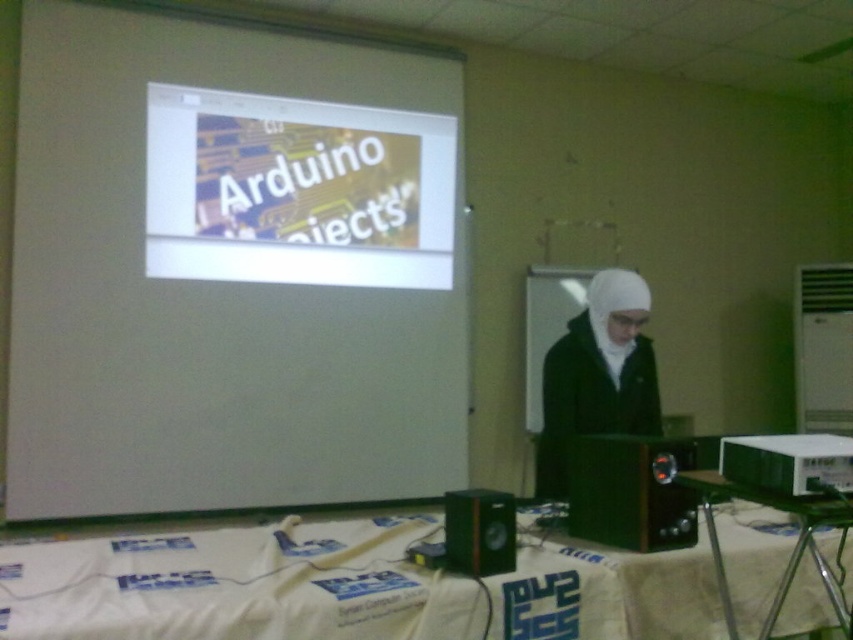
Who is positioned more to the right, green plastic table at lower right or white plastic projector at lower right?

From the viewer's perspective, white plastic projector at lower right appears more on the right side.

Can you confirm if green plastic table at lower right is taller than white plastic projector at lower right?

Indeed, green plastic table at lower right has a greater height compared to white plastic projector at lower right.

Measure the distance between green plastic table at lower right and camera.

green plastic table at lower right and camera are 4.86 feet apart from each other.

Locate an element on the screen. green plastic table at lower right is located at coordinates (793, 547).

In the scene shown: Does white plastic projector at lower right have a lesser width compared to black plastic speaker at lower center?

No.

Who is higher up, white plastic projector at lower right or black plastic speaker at lower center?

white plastic projector at lower right is above.

Is point (778, 448) positioned in front of point (448, 528)?

Yes.

Where is `white plastic projector at lower right`? Image resolution: width=853 pixels, height=640 pixels. white plastic projector at lower right is located at coordinates (788, 461).

Can you confirm if white matte projection screen at upper left is shorter than metallic black speaker at lower right?

No, white matte projection screen at upper left is not shorter than metallic black speaker at lower right.

Is point (229, 324) more distant than point (611, 540)?

Yes.

Locate an element on the screen. Image resolution: width=853 pixels, height=640 pixels. white matte projection screen at upper left is located at coordinates (227, 273).